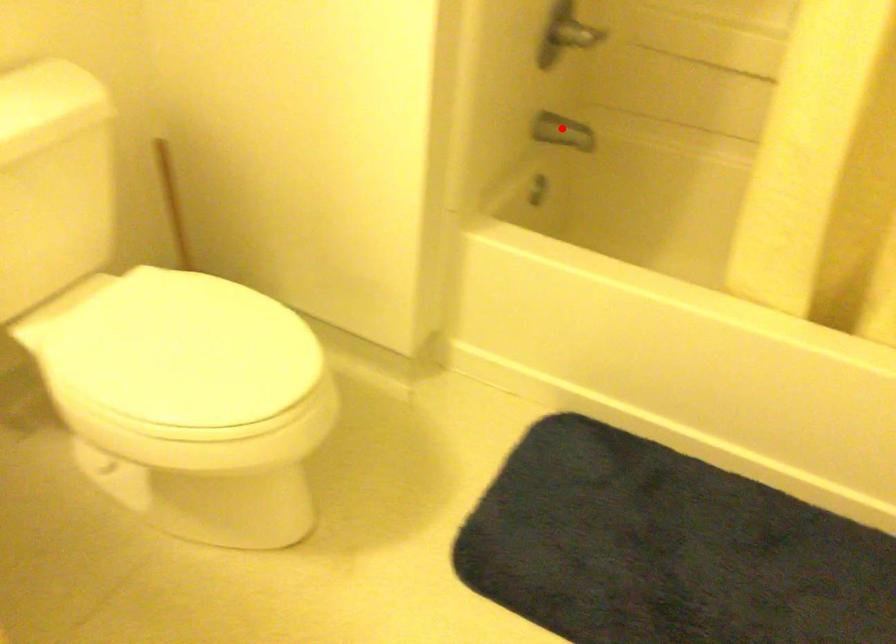
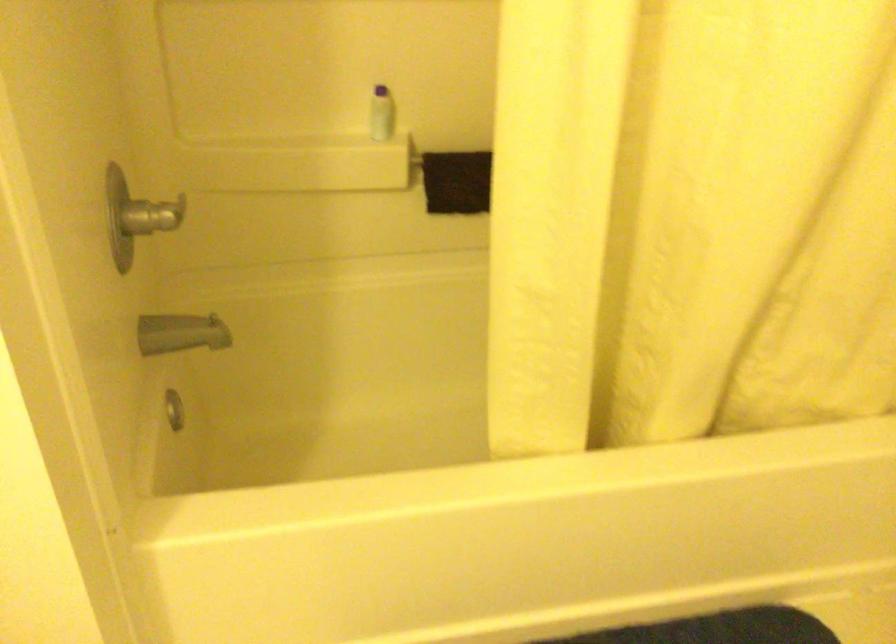
Question: I am providing you with two images of the same scene from different viewpoints. A red point is shown in image1. For the corresponding object point in image2, is it positioned nearer or farther from the camera?

Choices:
 (A) Nearer
 (B) Farther

Answer: (A)